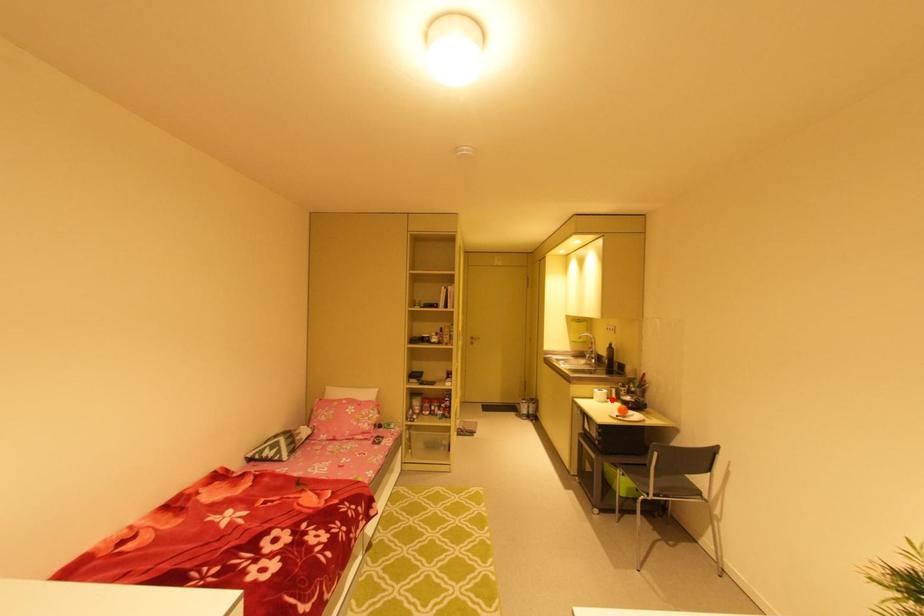
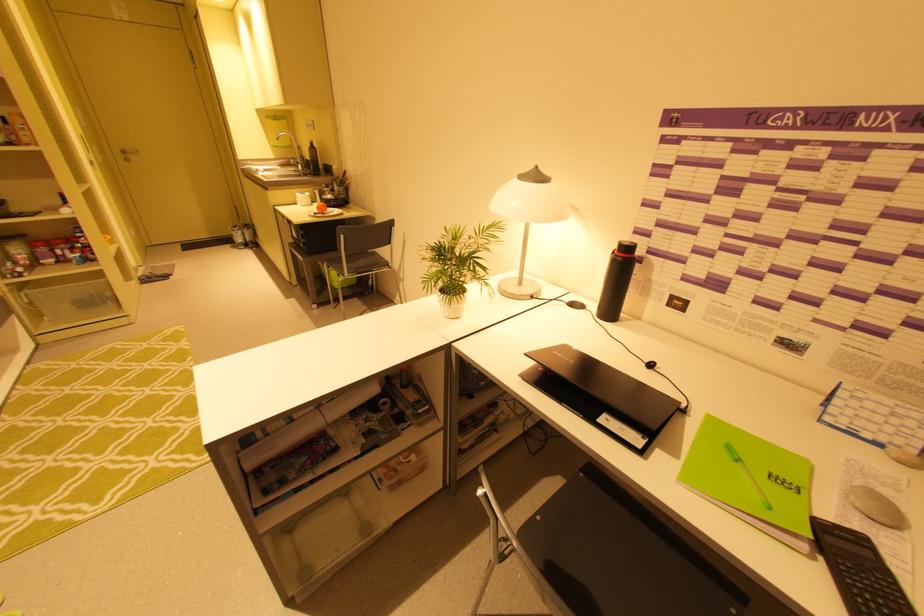
Where in the second image is the point corresponding to the highlighted location from the first image?

(317, 203)